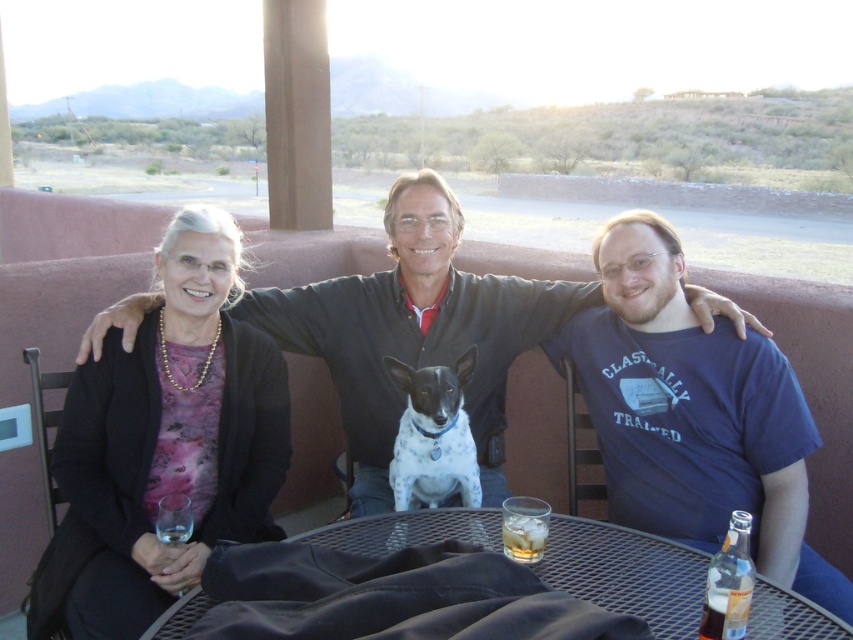
You are a delivery person who needs to place a small package on the table without disturbing the items already there. The package is 30 cm long. Can you fit it on the metallic mesh table at center?

The metallic mesh table at center has enough space to accommodate the 30 cm long package since the items on it are 1.25 meters apart, providing sufficient room.

You are a photographer setting up a shoot in the desert. You notice two shirts on the table in the image. The blue cotton shirt at center and the smooth brown shirt at center. Which shirt is closer to the camera?

The blue cotton shirt at center is located below the smooth brown shirt at center, so the smooth brown shirt at center is closer to the camera.

You are a photographer setting up a shot of the blue cotton shirt at center and the clear glass ice at table center. To ensure both are in focus, you need to know their relative positions. Which object is located to the right of the other?

The blue cotton shirt at center is positioned on the right side of clear glass ice at table center, so the blue cotton shirt at center is to the right of the clear glass ice at table center.